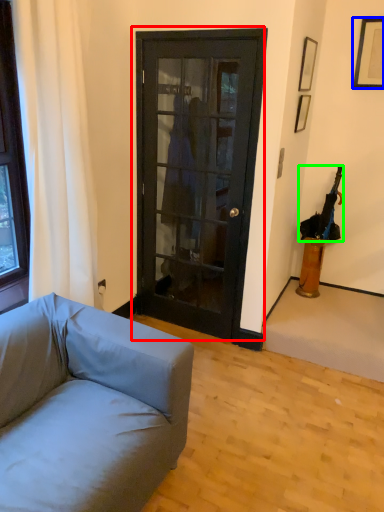
Question: Which object is the closest to the door (highlighted by a red box)? Choose among these: picture frame (highlighted by a blue box) or umbrella (highlighted by a green box).

Choices:
 (A) picture frame
 (B) umbrella

Answer: (B)